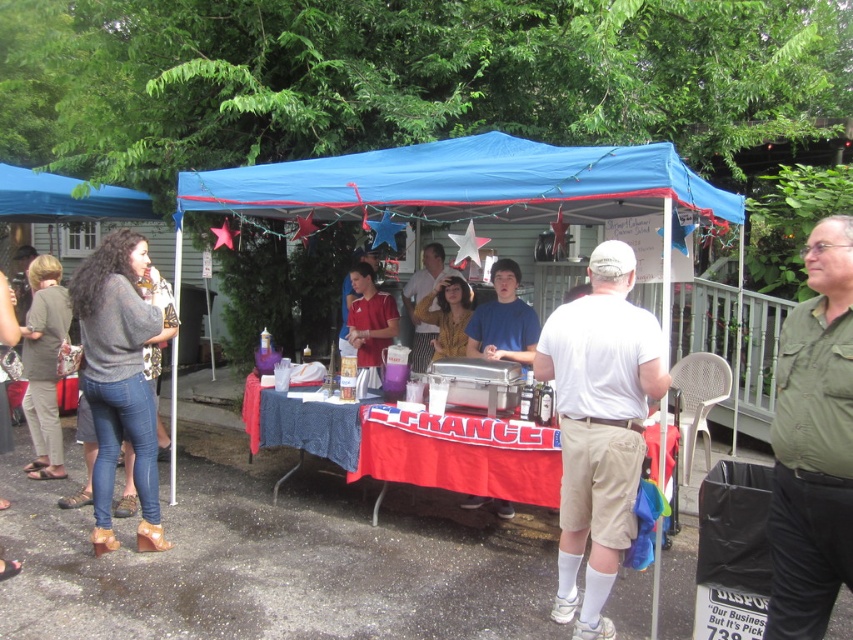
Does white cotton shirt at center lie in front of green cotton shirt at center?

No.

Is point (563, 522) farther from camera compared to point (827, 300)?

Yes.

The width and height of the screenshot is (853, 640). Describe the element at coordinates (599, 426) in the screenshot. I see `white cotton shirt at center` at that location.

At what (x,y) coordinates should I click in order to perform the action: click on white cotton shirt at center. Please return your answer as a coordinate pair (x, y). Looking at the image, I should click on (599, 426).

This screenshot has width=853, height=640. Describe the element at coordinates (599, 426) in the screenshot. I see `white cotton shirt at center` at that location.

Which of these two, white cotton shirt at center or blue fabric canopy at upper left, stands taller?

With more height is white cotton shirt at center.

What do you see at coordinates (599, 426) in the screenshot?
I see `white cotton shirt at center` at bounding box center [599, 426].

Identify the location of white cotton shirt at center. Image resolution: width=853 pixels, height=640 pixels. (599, 426).

Is white cotton shirt at center behind yellow striped shirt at center?

That is False.

Does point (570, 317) come farther from viewer compared to point (412, 292)?

That is False.

This screenshot has height=640, width=853. Identify the location of white cotton shirt at center. click(599, 426).